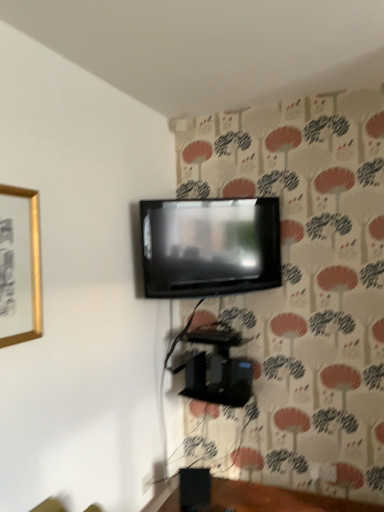
Question: Considering the relative sizes of gold metallic picture frame at upper left and black glossy speaker at lower center in the image provided, is gold metallic picture frame at upper left smaller than black glossy speaker at lower center?

Choices:
 (A) no
 (B) yes

Answer: (B)

Question: Is gold metallic picture frame at upper left shorter than black glossy speaker at lower center?

Choices:
 (A) yes
 (B) no

Answer: (B)

Question: Does gold metallic picture frame at upper left turn towards black glossy speaker at lower center?

Choices:
 (A) yes
 (B) no

Answer: (B)

Question: Is gold metallic picture frame at upper left to the left of black glossy speaker at lower center from the viewer's perspective?

Choices:
 (A) no
 (B) yes

Answer: (B)

Question: Considering the relative sizes of gold metallic picture frame at upper left and black glossy speaker at lower center in the image provided, is gold metallic picture frame at upper left thinner than black glossy speaker at lower center?

Choices:
 (A) no
 (B) yes

Answer: (B)

Question: Is black glossy speaker at lower center surrounded by gold metallic picture frame at upper left?

Choices:
 (A) no
 (B) yes

Answer: (A)

Question: Does black glossy speaker at lower center touch black matte speaker at lower center?

Choices:
 (A) yes
 (B) no

Answer: (B)

Question: Is black glossy speaker at lower center closer to camera compared to black matte speaker at lower center?

Choices:
 (A) no
 (B) yes

Answer: (B)

Question: Is black glossy speaker at lower center outside of black matte speaker at lower center?

Choices:
 (A) yes
 (B) no

Answer: (A)

Question: Considering the relative sizes of black glossy speaker at lower center and black matte speaker at lower center in the image provided, is black glossy speaker at lower center bigger than black matte speaker at lower center?

Choices:
 (A) yes
 (B) no

Answer: (A)

Question: Does black glossy speaker at lower center have a greater height compared to black matte speaker at lower center?

Choices:
 (A) yes
 (B) no

Answer: (A)

Question: From a real-world perspective, is black glossy speaker at lower center over black matte speaker at lower center?

Choices:
 (A) no
 (B) yes

Answer: (A)

Question: Is matte black tv at upper center facing away from gold metallic picture frame at upper left?

Choices:
 (A) yes
 (B) no

Answer: (B)